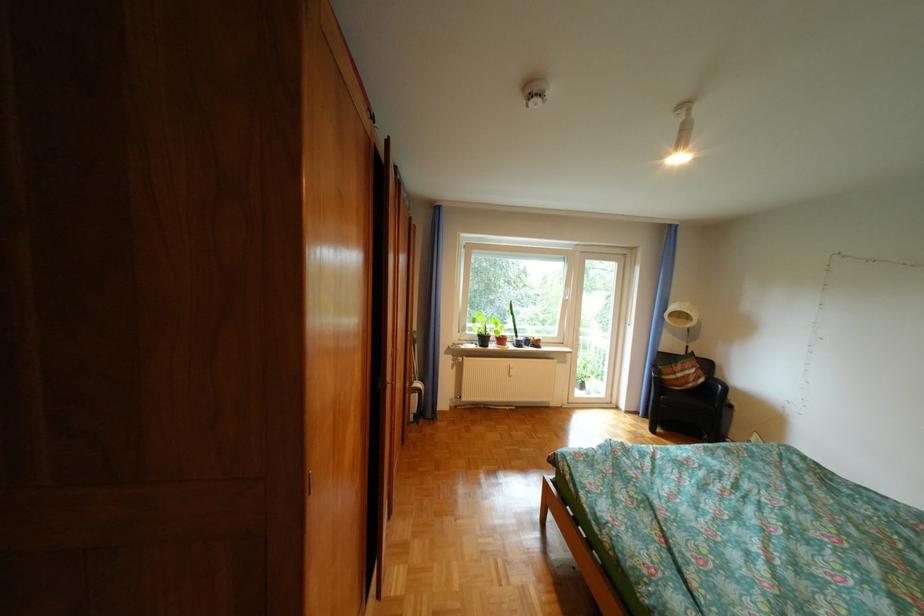
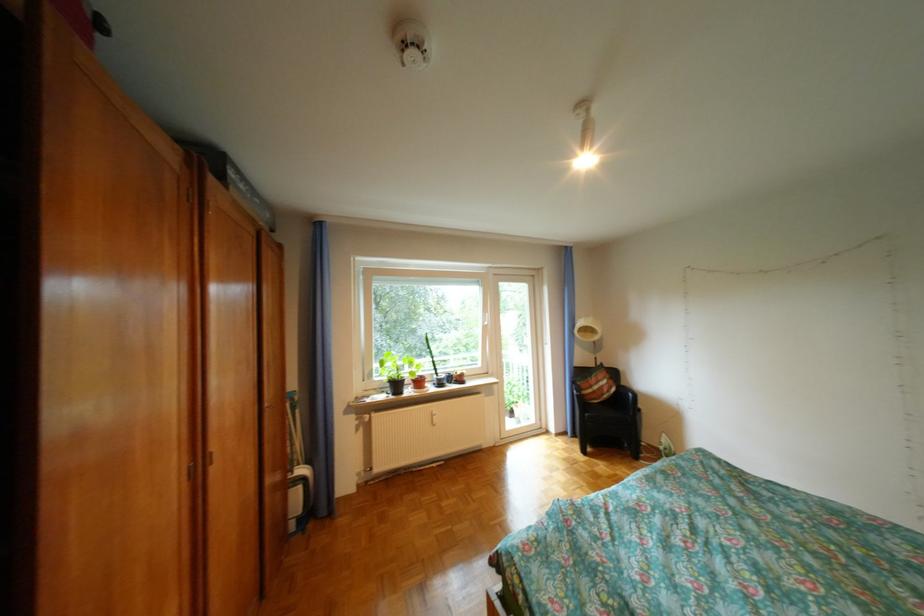
Where in the second image is the point corresponding to (x=497, y=339) from the first image?

(410, 386)